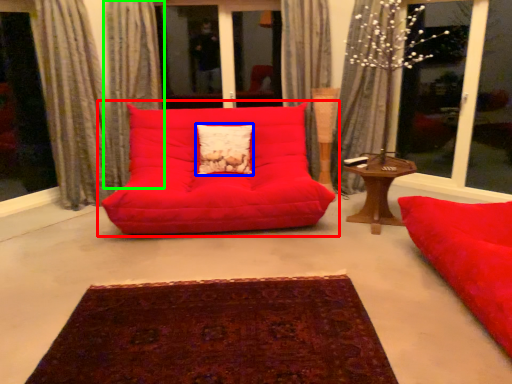
Question: Which object is the farthest from studio couch (highlighted by a red box)? Choose among these: pillow (highlighted by a blue box) or curtain (highlighted by a green box).

Choices:
 (A) pillow
 (B) curtain

Answer: (B)